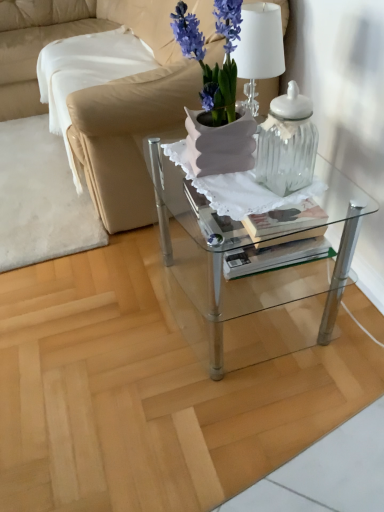
Find the location of a particular element. The image size is (384, 512). clear glass table at center is located at coordinates (239, 285).

From the picture: Is clear glass table at center bigger or smaller than beige leather couch at upper left?

In the image, clear glass table at center appears to be smaller than beige leather couch at upper left.

Is point (171, 298) closer or farther from the camera than point (91, 136)?

Point (171, 298) is positioned closer to the camera compared to point (91, 136).

Is beige leather couch at upper left at the back of clear glass table at center?

That's not correct — clear glass table at center is not looking away from beige leather couch at upper left.

Which is more to the left, clear glass table at center or beige leather couch at upper left?

beige leather couch at upper left is more to the left.

Can you confirm if purple matte vase at center is positioned to the left of beige leather couch at upper left?

No, purple matte vase at center is not to the left of beige leather couch at upper left.

Between purple matte vase at center and beige leather couch at upper left, which one has smaller width?

purple matte vase at center.

Between purple matte vase at center and beige leather couch at upper left, which one has smaller size?

Smaller between the two is purple matte vase at center.

From a real-world perspective, which is physically below, purple matte vase at center or beige leather couch at upper left?

beige leather couch at upper left, from a real-world perspective.

Considering the relative sizes of clear glass jar at center and beige leather couch at upper left in the image provided, is clear glass jar at center wider than beige leather couch at upper left?

Incorrect, the width of clear glass jar at center does not surpass that of beige leather couch at upper left.

Identify the location of candle holder that is in front of the beige leather couch at upper left. (287, 143).

Relative to beige leather couch at upper left, is clear glass jar at center in front or behind?

Visually, clear glass jar at center is located in front of beige leather couch at upper left.

Can you tell me how much clear glass jar at center and beige leather couch at upper left differ in facing direction?

They differ by 13.8 degrees in their facing directions.

Considering the positions of objects clear glass jar at center and purple matte vase at center in the image provided, who is more to the left, clear glass jar at center or purple matte vase at center?

purple matte vase at center is more to the left.

Can purple matte vase at center be found inside clear glass jar at center?

Actually, purple matte vase at center is outside clear glass jar at center.

From the image's perspective, is clear glass jar at center positioned above or below purple matte vase at center?

From the image's perspective, clear glass jar at center appears below purple matte vase at center.

From a real-world perspective, is clear glass jar at center above or below purple matte vase at center?

clear glass jar at center is situated lower than purple matte vase at center in the real world.

Does beige leather couch at upper left turn towards purple matte vase at center?

No, beige leather couch at upper left is not facing towards purple matte vase at center.

Which is more to the left, beige leather couch at upper left or purple matte vase at center?

beige leather couch at upper left is more to the left.

Considering the positions of objects beige leather couch at upper left and purple matte vase at center in the image provided, who is behind, beige leather couch at upper left or purple matte vase at center?

beige leather couch at upper left is further from the camera.

Is beige leather couch at upper left far from purple matte vase at center?

Yes.

Does clear glass jar at center have a lesser width compared to clear glass table at center?

Indeed, clear glass jar at center has a lesser width compared to clear glass table at center.

Considering the positions of objects clear glass jar at center and clear glass table at center in the image provided, who is more to the left, clear glass jar at center or clear glass table at center?

From the viewer's perspective, clear glass table at center appears more on the left side.

Is clear glass jar at center oriented towards clear glass table at center?

No, clear glass jar at center does not turn towards clear glass table at center.

Considering their positions, is purple matte vase at center located in front of or behind clear glass table at center?

In the image, purple matte vase at center appears in front of clear glass table at center.

Based on the photo, can you confirm if purple matte vase at center is thinner than clear glass table at center?

Correct, the width of purple matte vase at center is less than that of clear glass table at center.

From a real-world perspective, is purple matte vase at center located beneath clear glass table at center?

Actually, purple matte vase at center is physically above clear glass table at center in the real world.

Is purple matte vase at center looking in the opposite direction of clear glass table at center?

No, purple matte vase at center is not facing away from clear glass table at center.

Where is `table located in front of the beige leather couch at upper left`? This screenshot has height=512, width=384. table located in front of the beige leather couch at upper left is located at coordinates (239, 285).

Where is `houseplant below the beige leather couch at upper left (from the image's perspective)`? This screenshot has width=384, height=512. houseplant below the beige leather couch at upper left (from the image's perspective) is located at coordinates (216, 63).

Which object lies nearer to the anchor point beige leather couch at upper left, clear glass jar at center or purple matte vase at center?

Among the two, purple matte vase at center is located nearer to beige leather couch at upper left.

Based on their spatial positions, is purple matte vase at center or beige leather couch at upper left closer to clear glass table at center?

Among the two, purple matte vase at center is located nearer to clear glass table at center.

Considering their positions, is clear glass jar at center positioned closer to purple matte vase at center than clear glass table at center?

clear glass jar at center lies closer to purple matte vase at center than the other object.

Based on their spatial positions, is beige leather couch at upper left or purple matte vase at center closer to clear glass jar at center?

purple matte vase at center.

Looking at the image, which one is located closer to purple matte vase at center, clear glass jar at center or beige leather couch at upper left?

Based on the image, clear glass jar at center appears to be nearer to purple matte vase at center.

Looking at the image, which one is located closer to clear glass table at center, beige leather couch at upper left or purple matte vase at center?

Among the two, purple matte vase at center is located nearer to clear glass table at center.

Estimate the real-world distances between objects in this image. Which object is closer to clear glass table at center, purple matte vase at center or clear glass jar at center?

purple matte vase at center is closer to clear glass table at center.

Which object lies further to the anchor point clear glass jar at center, purple matte vase at center or clear glass table at center?

Based on the image, clear glass table at center appears to be further to clear glass jar at center.

At what (x,y) coordinates should I click in order to perform the action: click on candle holder between beige leather couch at upper left and clear glass table at center in the up-down direction. Please return your answer as a coordinate pair (x, y). Image resolution: width=384 pixels, height=512 pixels. Looking at the image, I should click on (287, 143).

At what (x,y) coordinates should I click in order to perform the action: click on candle holder that lies between purple matte vase at center and clear glass table at center from top to bottom. Please return your answer as a coordinate pair (x, y). The image size is (384, 512). Looking at the image, I should click on (287, 143).

Identify the location of houseplant between beige leather couch at upper left and clear glass jar at center vertically. (216, 63).

In order to click on houseplant between beige leather couch at upper left and clear glass table at center in the up-down direction in this screenshot , I will do `click(216, 63)`.